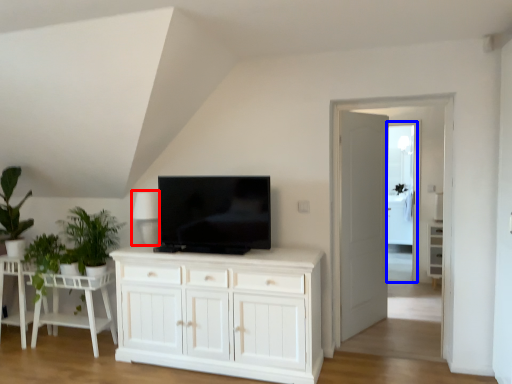
Question: Which of the following is the closest to the observer, lamp (highlighted by a red box) or glass door (highlighted by a blue box)?

Choices:
 (A) lamp
 (B) glass door

Answer: (A)